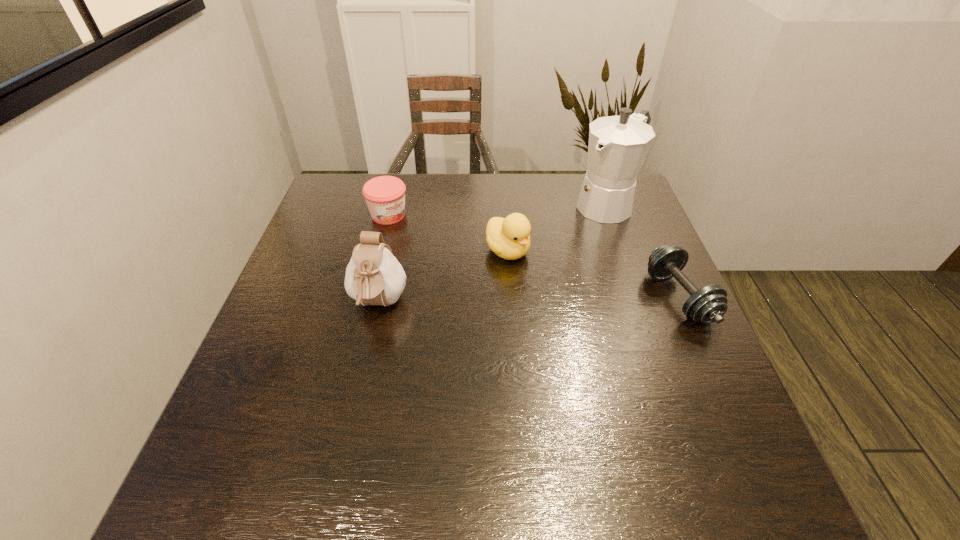
This screenshot has width=960, height=540. Find the location of `vacant space located 0.260m on the front label of the jam`. vacant space located 0.260m on the front label of the jam is located at coordinates (461, 270).

Identify the location of free space located at the spout of the tallest object. (533, 269).

Where is `free space located 0.400m at the spout of the tallest object`? free space located 0.400m at the spout of the tallest object is located at coordinates (502, 295).

The image size is (960, 540). Identify the location of free spot located 0.300m at the spout of the tallest object. (528, 274).

In order to click on vacant space located on the front-facing side of the duck in this screenshot , I will do `click(547, 282)`.

Where is `free location located on the front-facing side of the duck`? This screenshot has height=540, width=960. free location located on the front-facing side of the duck is located at coordinates (587, 313).

The height and width of the screenshot is (540, 960). I want to click on vacant space situated on the front-facing side of the duck, so click(x=564, y=296).

Where is `jam present at the far edge`? This screenshot has width=960, height=540. jam present at the far edge is located at coordinates click(385, 195).

At what (x,y) coordinates should I click in order to perform the action: click on coffeepot located in the far edge section of the desktop. Please return your answer as a coordinate pair (x, y). Looking at the image, I should click on (618, 145).

Where is `object that is at the left edge`? object that is at the left edge is located at coordinates (385, 195).